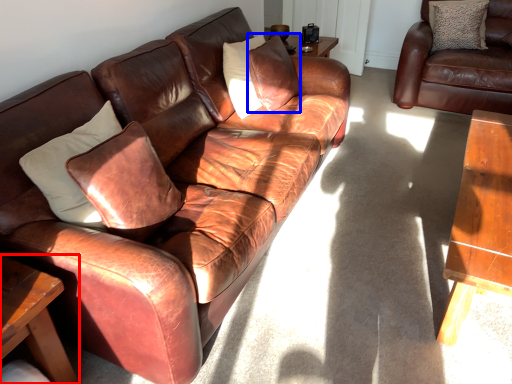
Question: Which object appears closest to the camera in this image, table (highlighted by a red box) or pillow (highlighted by a blue box)?

Choices:
 (A) table
 (B) pillow

Answer: (A)